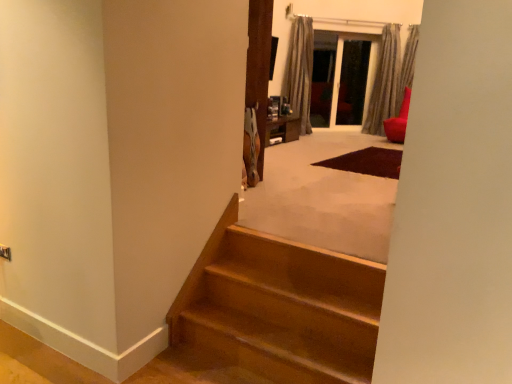
Locate an element on the screen. This screenshot has height=384, width=512. wooden stairs at lower center is located at coordinates (283, 311).

The image size is (512, 384). Describe the element at coordinates (283, 311) in the screenshot. I see `wooden stairs at lower center` at that location.

Image resolution: width=512 pixels, height=384 pixels. In order to click on wooden stairs at lower center in this screenshot , I will do `click(283, 311)`.